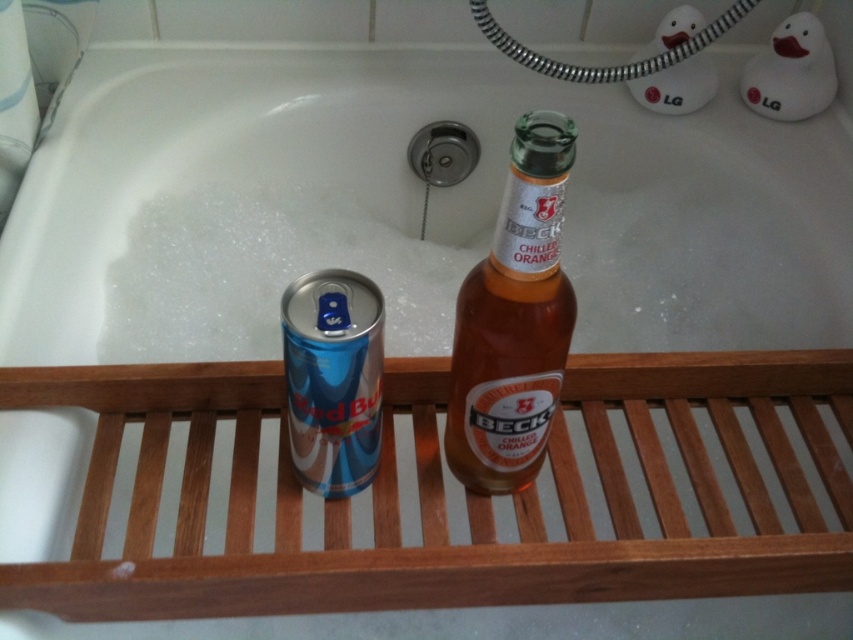
Does translucent amber glass bottle at center come in front of blue metallic red bull can at left?

Yes, translucent amber glass bottle at center is closer to the viewer.

Does point (544, 266) come behind point (349, 276)?

No, (544, 266) is in front of (349, 276).

Find the location of a particular element. The width and height of the screenshot is (853, 640). translucent amber glass bottle at center is located at coordinates click(514, 321).

Can you confirm if white glossy bathtub at upper center is positioned to the right of translucent amber glass bottle at center?

In fact, white glossy bathtub at upper center is to the left of translucent amber glass bottle at center.

Does point (567, 268) come in front of point (498, 481)?

No, (567, 268) is further to viewer.

The height and width of the screenshot is (640, 853). In order to click on white glossy bathtub at upper center in this screenshot , I will do `click(404, 208)`.

Who is shorter, white glossy bathtub at upper center or blue metallic red bull can at left?

With less height is blue metallic red bull can at left.

Is point (604, 205) positioned in front of point (343, 282)?

No, it is behind (343, 282).

Who is more distant from viewer, (770, 198) or (289, 428)?

Point (770, 198)

Identify the location of white glossy bathtub at upper center. (404, 208).